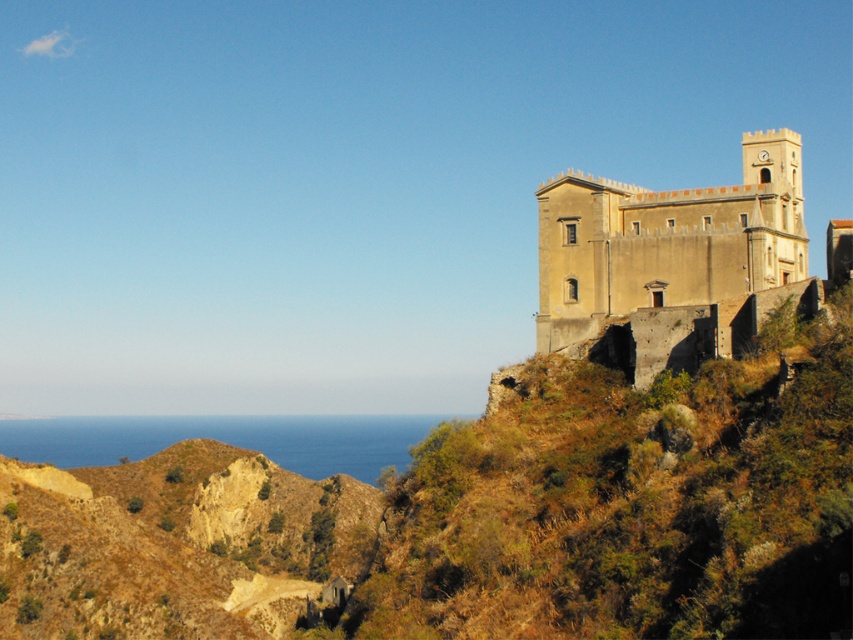
Question: Which point is farther to the camera?

Choices:
 (A) beige stone fort at upper right
 (B) brown rocky hill at lower left

Answer: (B)

Question: Is brown rocky hill at lower left below beige stone fort at upper right?

Choices:
 (A) yes
 (B) no

Answer: (A)

Question: Which point is closer to the camera taking this photo?

Choices:
 (A) (787, 176)
 (B) (225, 545)

Answer: (A)

Question: Is brown rocky hill at lower left further to camera compared to beige stone fort at upper right?

Choices:
 (A) no
 (B) yes

Answer: (B)

Question: Does brown rocky hill at lower left appear under beige stone fort at upper right?

Choices:
 (A) yes
 (B) no

Answer: (A)

Question: Which object appears closest to the camera in this image?

Choices:
 (A) beige stone fort at upper right
 (B) brown rocky hill at lower left

Answer: (A)